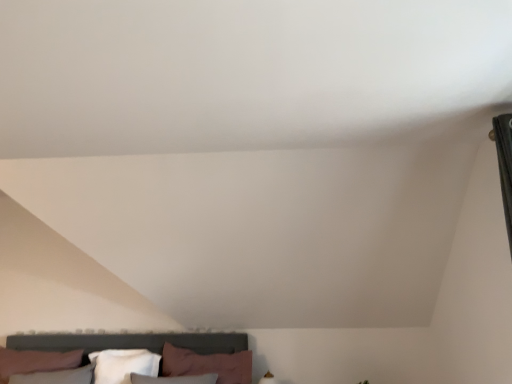
Describe the element at coordinates (207, 364) in the screenshot. I see `pink fabric pillow at lower center, which appears as the first pillow when viewed from the right` at that location.

The image size is (512, 384). In order to click on pink fabric pillow at lower center, positioned as the second pillow in left-to-right order in this screenshot , I will do `click(207, 364)`.

In order to face white soft pillow at lower center, the first pillow viewed from the left, should I rotate leftwards or rightwards?

A 17.133 degree turn to the left will do.

Where is `white soft pillow at lower center, the first pillow viewed from the left`? The height and width of the screenshot is (384, 512). white soft pillow at lower center, the first pillow viewed from the left is located at coordinates (123, 365).

The height and width of the screenshot is (384, 512). What do you see at coordinates (123, 365) in the screenshot? I see `white soft pillow at lower center, the first pillow viewed from the left` at bounding box center [123, 365].

Image resolution: width=512 pixels, height=384 pixels. What are the coordinates of `pink fabric pillow at lower center, which appears as the first pillow when viewed from the right` in the screenshot? It's located at (207, 364).

Between white soft pillow at lower center, the first pillow viewed from the left, and pink fabric pillow at lower center, which appears as the first pillow when viewed from the right, which one appears on the left side from the viewer's perspective?

From the viewer's perspective, white soft pillow at lower center, the first pillow viewed from the left, appears more on the left side.

Relative to pink fabric pillow at lower center, which appears as the first pillow when viewed from the right, is white soft pillow at lower center, the second pillow in the right-to-left sequence, in front or behind?

white soft pillow at lower center, the second pillow in the right-to-left sequence, is behind pink fabric pillow at lower center, which appears as the first pillow when viewed from the right.

Is point (113, 358) more distant than point (230, 371)?

Yes, it is behind point (230, 371).

From the image's perspective, which is above, white soft pillow at lower center, the second pillow in the right-to-left sequence, or pink fabric pillow at lower center, which appears as the first pillow when viewed from the right?

pink fabric pillow at lower center, which appears as the first pillow when viewed from the right, from the image's perspective.

From a real-world perspective, is white soft pillow at lower center, the first pillow viewed from the left, positioned over pink fabric pillow at lower center, positioned as the second pillow in left-to-right order, based on gravity?

No, from a real-world perspective, white soft pillow at lower center, the first pillow viewed from the left, is not over pink fabric pillow at lower center, positioned as the second pillow in left-to-right order

Which of these two, white soft pillow at lower center, the second pillow in the right-to-left sequence, or pink fabric pillow at lower center, positioned as the second pillow in left-to-right order, is thinner?

With smaller width is white soft pillow at lower center, the second pillow in the right-to-left sequence.

Between white soft pillow at lower center, the second pillow in the right-to-left sequence, and pink fabric pillow at lower center, positioned as the second pillow in left-to-right order, which one has less height?

white soft pillow at lower center, the second pillow in the right-to-left sequence.

In terms of size, does white soft pillow at lower center, the first pillow viewed from the left, appear bigger or smaller than pink fabric pillow at lower center, positioned as the second pillow in left-to-right order?

In the image, white soft pillow at lower center, the first pillow viewed from the left, appears to be smaller than pink fabric pillow at lower center, positioned as the second pillow in left-to-right order.

Choose the correct answer: Is white soft pillow at lower center, the second pillow in the right-to-left sequence, inside pink fabric pillow at lower center, positioned as the second pillow in left-to-right order, or outside it?

white soft pillow at lower center, the second pillow in the right-to-left sequence, lies outside pink fabric pillow at lower center, positioned as the second pillow in left-to-right order.

Consider the image. Is white soft pillow at lower center, the first pillow viewed from the left, next to pink fabric pillow at lower center, positioned as the second pillow in left-to-right order, and touching it?

No, white soft pillow at lower center, the first pillow viewed from the left, is not making contact with pink fabric pillow at lower center, positioned as the second pillow in left-to-right order.

Is white soft pillow at lower center, the first pillow viewed from the left, oriented away from pink fabric pillow at lower center, which appears as the first pillow when viewed from the right?

white soft pillow at lower center, the first pillow viewed from the left, is not turned away from pink fabric pillow at lower center, which appears as the first pillow when viewed from the right.

Where is `pillow located on the left of pink fabric pillow at lower center, which appears as the first pillow when viewed from the right`? The width and height of the screenshot is (512, 384). pillow located on the left of pink fabric pillow at lower center, which appears as the first pillow when viewed from the right is located at coordinates (123, 365).

Considering the positions of objects pink fabric pillow at lower center, which appears as the first pillow when viewed from the right, and white soft pillow at lower center, the first pillow viewed from the left, in the image provided, who is more to the right, pink fabric pillow at lower center, which appears as the first pillow when viewed from the right, or white soft pillow at lower center, the first pillow viewed from the left,?

Positioned to the right is pink fabric pillow at lower center, which appears as the first pillow when viewed from the right.

Which is in front, pink fabric pillow at lower center, positioned as the second pillow in left-to-right order, or white soft pillow at lower center, the second pillow in the right-to-left sequence?

pink fabric pillow at lower center, positioned as the second pillow in left-to-right order, is closer to the camera.

Does point (214, 361) appear closer or farther from the camera than point (149, 366)?

Point (214, 361).

From the image's perspective, is pink fabric pillow at lower center, which appears as the first pillow when viewed from the right, located above or below white soft pillow at lower center, the second pillow in the right-to-left sequence?

pink fabric pillow at lower center, which appears as the first pillow when viewed from the right, is situated higher than white soft pillow at lower center, the second pillow in the right-to-left sequence, in the image.

From a real-world perspective, is pink fabric pillow at lower center, which appears as the first pillow when viewed from the right, under white soft pillow at lower center, the second pillow in the right-to-left sequence?

No.

Is pink fabric pillow at lower center, which appears as the first pillow when viewed from the right, wider than white soft pillow at lower center, the first pillow viewed from the left?

Correct, the width of pink fabric pillow at lower center, which appears as the first pillow when viewed from the right, exceeds that of white soft pillow at lower center, the first pillow viewed from the left.

Is pink fabric pillow at lower center, which appears as the first pillow when viewed from the right, taller or shorter than white soft pillow at lower center, the second pillow in the right-to-left sequence?

In the image, pink fabric pillow at lower center, which appears as the first pillow when viewed from the right, appears to be taller than white soft pillow at lower center, the second pillow in the right-to-left sequence.

Can you confirm if pink fabric pillow at lower center, positioned as the second pillow in left-to-right order, is smaller than white soft pillow at lower center, the second pillow in the right-to-left sequence?

Incorrect, pink fabric pillow at lower center, positioned as the second pillow in left-to-right order, is not smaller in size than white soft pillow at lower center, the second pillow in the right-to-left sequence.

Is white soft pillow at lower center, the first pillow viewed from the left, surrounded by pink fabric pillow at lower center, which appears as the first pillow when viewed from the right?

That's incorrect, white soft pillow at lower center, the first pillow viewed from the left, is not inside pink fabric pillow at lower center, which appears as the first pillow when viewed from the right.

Are pink fabric pillow at lower center, positioned as the second pillow in left-to-right order, and white soft pillow at lower center, the first pillow viewed from the left, beside each other?

pink fabric pillow at lower center, positioned as the second pillow in left-to-right order, and white soft pillow at lower center, the first pillow viewed from the left, are clearly separated.

Is pink fabric pillow at lower center, positioned as the second pillow in left-to-right order, aimed at white soft pillow at lower center, the first pillow viewed from the left?

No.

What's the angular difference between pink fabric pillow at lower center, positioned as the second pillow in left-to-right order, and white soft pillow at lower center, the first pillow viewed from the left,'s facing directions?

The angular difference between pink fabric pillow at lower center, positioned as the second pillow in left-to-right order, and white soft pillow at lower center, the first pillow viewed from the left, is 0.00368 degrees.

Consider the image. How distant is pink fabric pillow at lower center, positioned as the second pillow in left-to-right order, from white soft pillow at lower center, the first pillow viewed from the left?

35.23 centimeters.

You are a GUI agent. You are given a task and a screenshot of the screen. Output one action in this format:
    pyautogui.click(x=<x>, y=<y>)
    Task: Click on the pillow in front of the white soft pillow at lower center, the second pillow in the right-to-left sequence
    
    Given the screenshot: What is the action you would take?
    pyautogui.click(x=207, y=364)

Find the location of `pillow above the white soft pillow at lower center, the second pillow in the right-to-left sequence (from a real-world perspective)`. pillow above the white soft pillow at lower center, the second pillow in the right-to-left sequence (from a real-world perspective) is located at coordinates [207, 364].

Locate an element on the screen. This screenshot has height=384, width=512. pillow below the pink fabric pillow at lower center, positioned as the second pillow in left-to-right order (from a real-world perspective) is located at coordinates (123, 365).